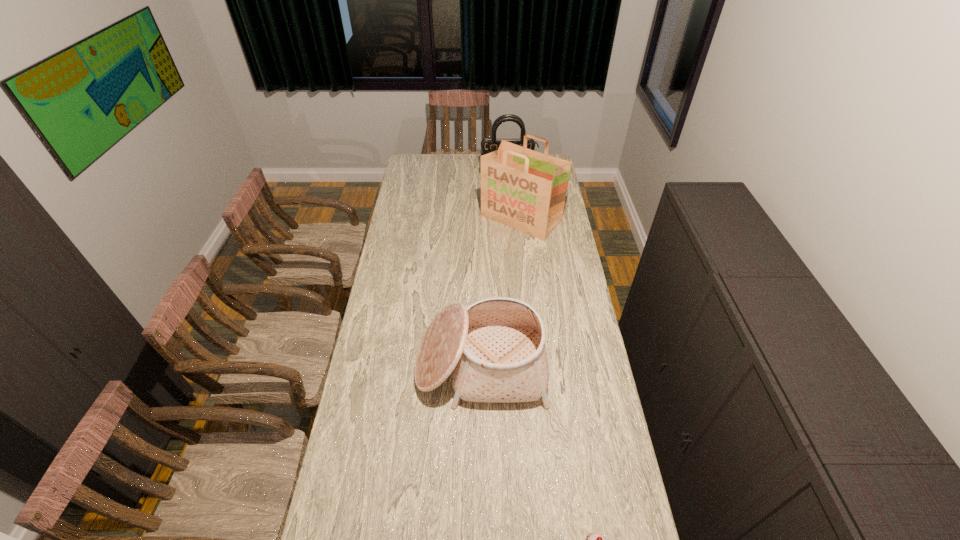
Find the location of `grocery bag that is at the right edge`. grocery bag that is at the right edge is located at coordinates (524, 189).

Where is `handbag situated at the right edge`? The image size is (960, 540). handbag situated at the right edge is located at coordinates (488, 145).

The width and height of the screenshot is (960, 540). Find the location of `object present at the far right corner`. object present at the far right corner is located at coordinates (488, 145).

Image resolution: width=960 pixels, height=540 pixels. Find the location of `vacant region at the left edge of the desktop`. vacant region at the left edge of the desktop is located at coordinates pyautogui.click(x=404, y=368).

Identify the location of vacant space at the right edge of the desktop. The height and width of the screenshot is (540, 960). (568, 295).

This screenshot has height=540, width=960. In the image, there is a desktop. Identify the location of vacant space at the far left corner. (424, 156).

Identify the location of vacant space that's between the second farthest object and the third farthest object. The width and height of the screenshot is (960, 540). (501, 293).

I want to click on free space that is in between the basket and the handbag, so click(494, 269).

You are a GUI agent. You are given a task and a screenshot of the screen. Output one action in this format:
    pyautogui.click(x=<x>, y=<y>)
    Task: Click on the vacant region between the third nearest object and the basket
    
    Given the screenshot: What is the action you would take?
    pyautogui.click(x=501, y=293)

Identify which object is the second nearest to the second tallest object. Please provide its 2D coordinates. Your answer should be formatted as a tuple, i.e. [(x, y)], where the tuple contains the x and y coordinates of a point satisfying the conditions above.

[(495, 349)]